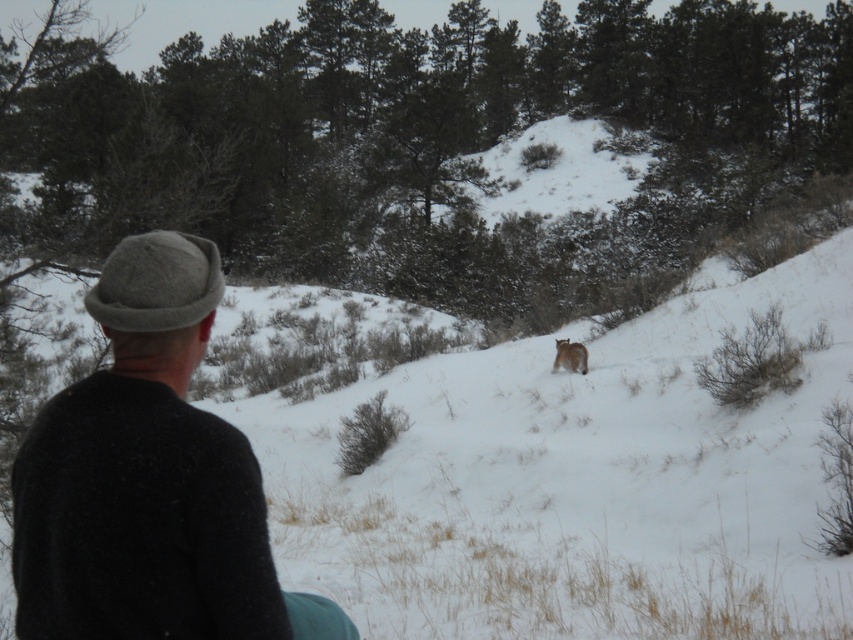
Who is more distant from viewer, [242,520] or [558,364]?

Point [558,364]

Can you confirm if gray woolen hat at left is thinner than furry brown cat at center?

No.

Between point (19, 529) and point (570, 342), which one is positioned in front?

Point (19, 529)

This screenshot has height=640, width=853. I want to click on gray woolen hat at left, so click(143, 476).